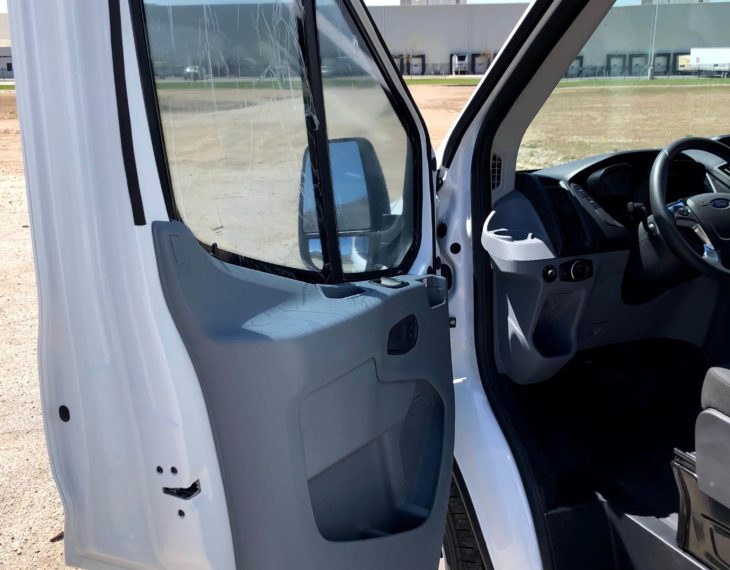
The image size is (730, 570). Identify the location of mirror. (349, 195), (355, 238).